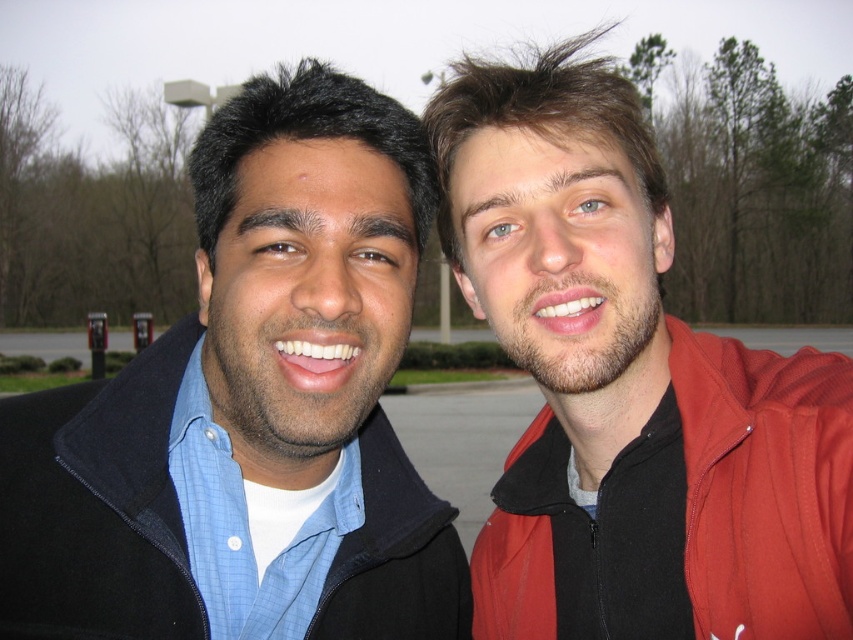
Question: Is red matte jacket at right bigger than red fleece jacket at right?

Choices:
 (A) yes
 (B) no

Answer: (A)

Question: Based on their relative distances, which object is farther from the matte black jacket at left?

Choices:
 (A) red fleece jacket at right
 (B) red matte jacket at right

Answer: (A)

Question: Among these points, which one is nearest to the camera?

Choices:
 (A) (570, 227)
 (B) (689, 330)

Answer: (A)

Question: Which point is farther to the camera?

Choices:
 (A) red matte jacket at right
 (B) matte black jacket at left
 (C) red fleece jacket at right

Answer: (B)

Question: Does red matte jacket at right have a larger size compared to red fleece jacket at right?

Choices:
 (A) no
 (B) yes

Answer: (B)

Question: Does matte black jacket at left have a lesser width compared to red fleece jacket at right?

Choices:
 (A) yes
 (B) no

Answer: (B)